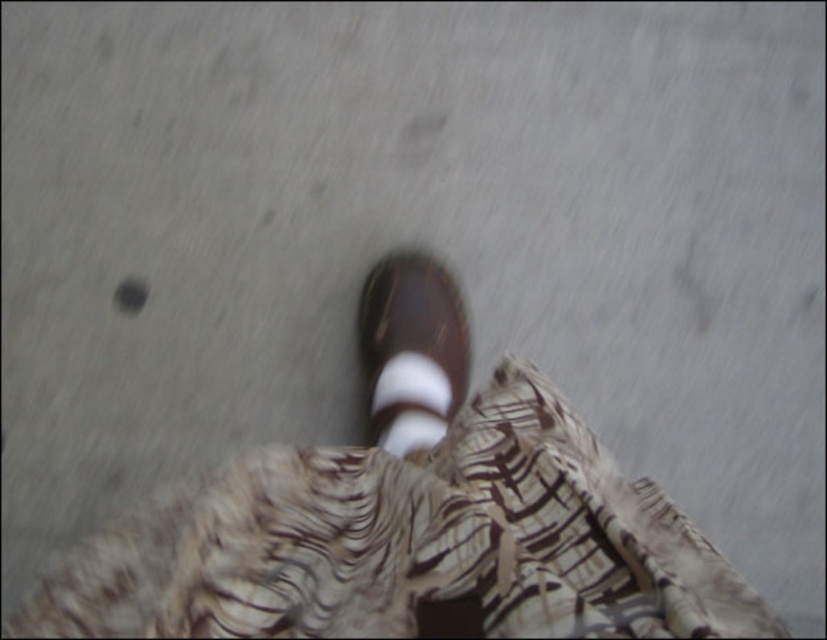
You are standing on a sidewalk and see a brown leather shoe at center and a white striped sock at center. Which object is closer to you?

The brown leather shoe at center is closer to you because it is positioned over the white striped sock at center.

You are standing on the sidewalk and see two points marked on the ground. The first point is at coordinates point (404, 324) and the second point is at point (381, 435). Which point is closer to your feet?

Point (404, 324) is closer to your feet because it is further to the viewer than point (381, 435).

From the picture: You are trying to avoid stepping on a small pebble that you see on the ground. You notice the brown leather shoe at center and the white striped sock at center. Which object is closer to you, and therefore requires more caution to avoid the pebble?

The brown leather shoe at center is closer to you than the white striped sock at center. Therefore, you should focus on adjusting your step around the brown leather shoe at center to avoid the pebble.